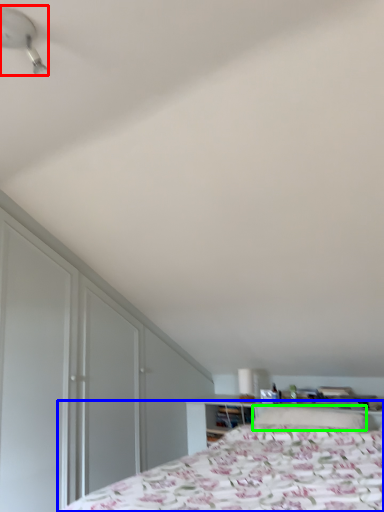
Question: Which object is the farthest from fan (highlighted by a red box)? Choose among these: bed (highlighted by a blue box) or pillow (highlighted by a green box).

Choices:
 (A) bed
 (B) pillow

Answer: (B)